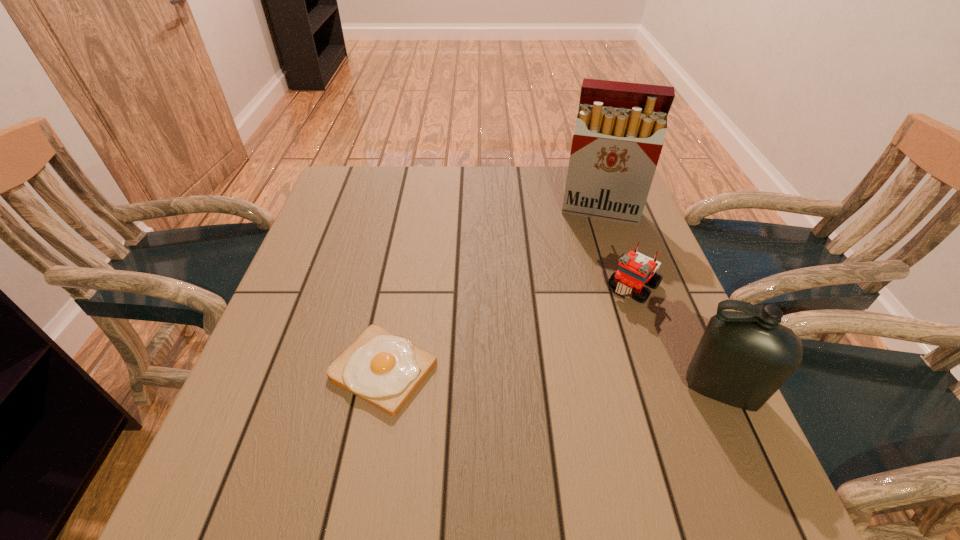
Where is `vacant area that lies between the second tallest object and the second shortest object`? vacant area that lies between the second tallest object and the second shortest object is located at coordinates (677, 338).

Where is `vacant space that is in between the leftmost object and the farthest object`? vacant space that is in between the leftmost object and the farthest object is located at coordinates (492, 290).

Locate an element on the screen. The width and height of the screenshot is (960, 540). free spot between the bottle and the third tallest object is located at coordinates (677, 338).

Locate an element on the screen. This screenshot has height=540, width=960. empty location between the third shortest object and the leftmost object is located at coordinates (x=552, y=380).

The width and height of the screenshot is (960, 540). Identify the location of vacant region between the toast and the third nearest object. (509, 328).

The width and height of the screenshot is (960, 540). I want to click on unoccupied area between the Lego and the second tallest object, so click(677, 338).

At what (x,y) coordinates should I click in order to perform the action: click on blank region between the leftmost object and the cigarette case. Please return your answer as a coordinate pair (x, y). This screenshot has height=540, width=960. Looking at the image, I should click on (492, 290).

Locate an element on the screen. This screenshot has height=540, width=960. free space between the second shortest object and the third shortest object is located at coordinates (677, 338).

Locate an element on the screen. empty space between the second shortest object and the leftmost object is located at coordinates (509, 328).

In order to click on empty space that is in between the leftmost object and the third tallest object in this screenshot , I will do `click(509, 328)`.